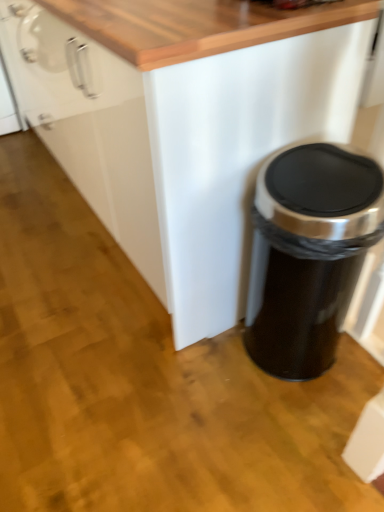
Question: Is the position of black matte trash can at lower right more distant than that of white matte cabinet at center?

Choices:
 (A) no
 (B) yes

Answer: (B)

Question: Is black matte trash can at lower right bigger than white matte cabinet at center?

Choices:
 (A) yes
 (B) no

Answer: (B)

Question: Does black matte trash can at lower right appear on the right side of white matte cabinet at center?

Choices:
 (A) yes
 (B) no

Answer: (A)

Question: Can you confirm if black matte trash can at lower right is thinner than white matte cabinet at center?

Choices:
 (A) no
 (B) yes

Answer: (B)

Question: Can we say black matte trash can at lower right lies outside white matte cabinet at center?

Choices:
 (A) no
 (B) yes

Answer: (B)

Question: Is black matte trash can at lower right smaller than white matte cabinet at center?

Choices:
 (A) yes
 (B) no

Answer: (A)

Question: Are white matte cabinet at center and black matte trash can at lower right far apart?

Choices:
 (A) yes
 (B) no

Answer: (B)

Question: Is black matte trash can at lower right inside white matte cabinet at center?

Choices:
 (A) no
 (B) yes

Answer: (A)

Question: Does white matte cabinet at center touch black matte trash can at lower right?

Choices:
 (A) no
 (B) yes

Answer: (A)

Question: Is white matte cabinet at center oriented away from black matte trash can at lower right?

Choices:
 (A) yes
 (B) no

Answer: (B)

Question: From the image's perspective, is white matte cabinet at center beneath black matte trash can at lower right?

Choices:
 (A) no
 (B) yes

Answer: (A)

Question: Does white matte cabinet at center turn towards black matte trash can at lower right?

Choices:
 (A) no
 (B) yes

Answer: (A)

Question: From a real-world perspective, is black matte trash can at lower right above or below white matte cabinet at center?

Choices:
 (A) below
 (B) above

Answer: (A)